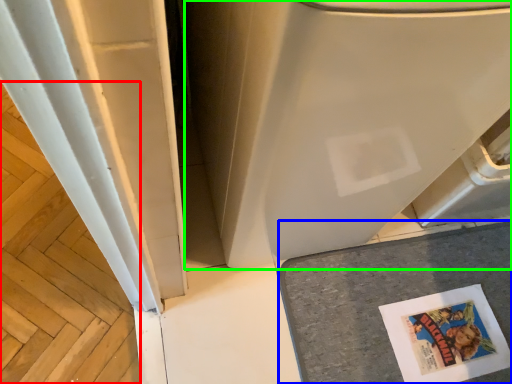
Question: Estimate the real-world distances between objects in this image. Which object is closer to wood (highlighted by a red box), counter top (highlighted by a blue box) or water heater (highlighted by a green box)?

Choices:
 (A) counter top
 (B) water heater

Answer: (B)